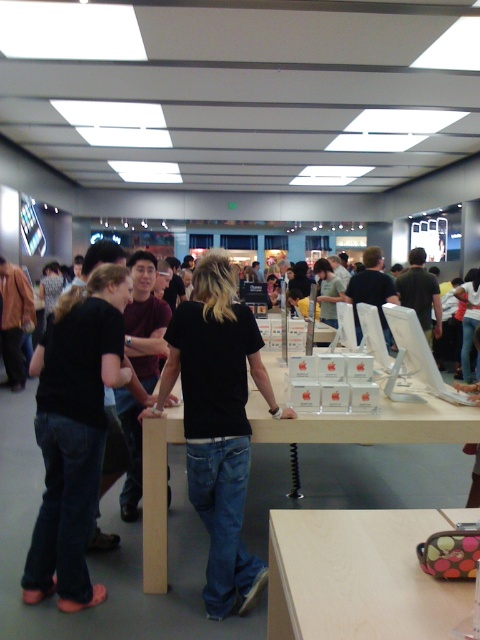
Question: Which of the following is the closest to the observer?

Choices:
 (A) (349, 433)
 (B) (389, 563)
 (C) (220, 442)

Answer: (B)

Question: In this image, where is wooden table at lower right located relative to light wood table at center?

Choices:
 (A) right
 (B) left

Answer: (B)

Question: Which point appears farthest from the camera in this image?

Choices:
 (A) (148, 572)
 (B) (327, 589)

Answer: (A)

Question: Is black matte shirt at center above light wood table at center?

Choices:
 (A) yes
 (B) no

Answer: (B)

Question: Which point appears closest to the camera in this image?

Choices:
 (A) (214, 378)
 (B) (177, 429)
 (C) (387, 634)

Answer: (C)

Question: Does wooden table at lower right appear on the left side of light wood table at center?

Choices:
 (A) no
 (B) yes

Answer: (B)